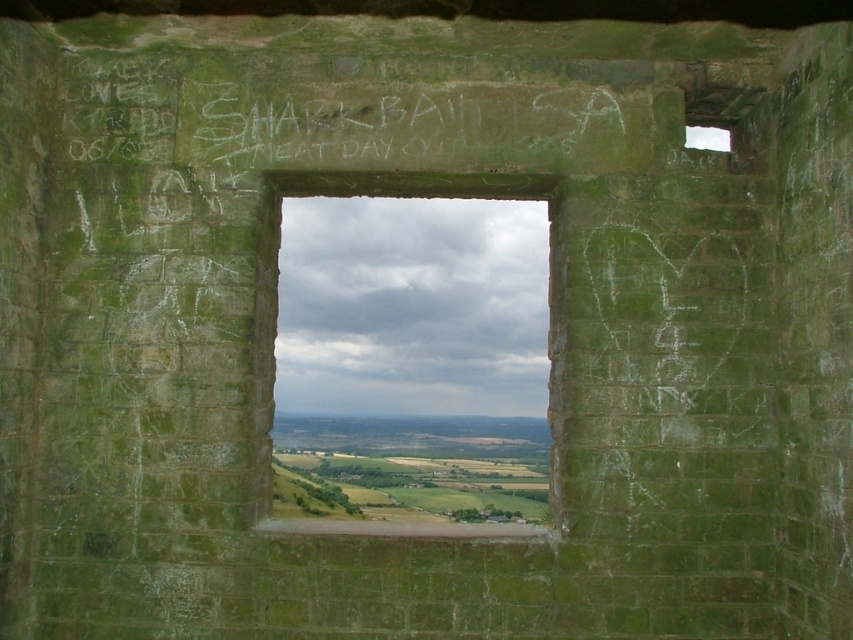
Question: Which object appears closest to the camera in this image?

Choices:
 (A) green stone window at center
 (B) white chalk graffiti at center

Answer: (A)

Question: Is green stone window at center positioned in front of white chalk graffiti at center?

Choices:
 (A) no
 (B) yes

Answer: (B)

Question: Can you confirm if green stone window at center is positioned to the right of white chalk graffiti at center?

Choices:
 (A) no
 (B) yes

Answer: (A)

Question: Which object appears closest to the camera in this image?

Choices:
 (A) white chalk graffiti at center
 (B) green stone window at center

Answer: (B)

Question: Can you confirm if green stone window at center is smaller than white chalk graffiti at center?

Choices:
 (A) yes
 (B) no

Answer: (B)